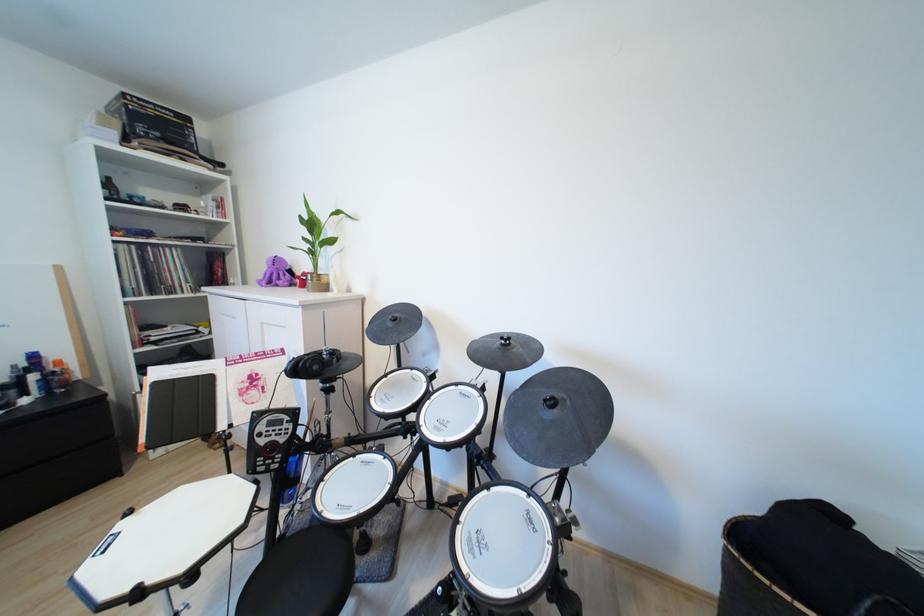
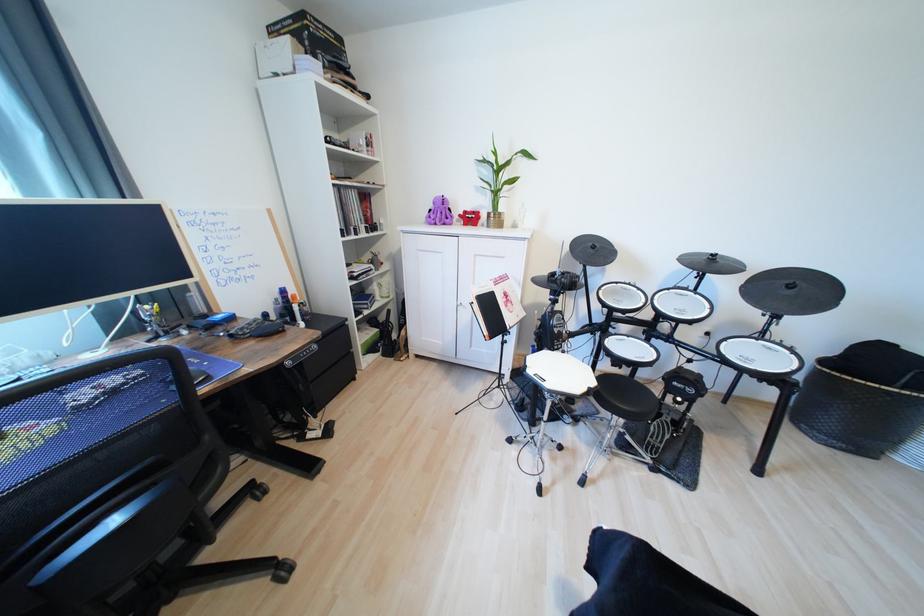
Where in the second image is the point corresponding to (396,325) from the first image?

(599, 252)